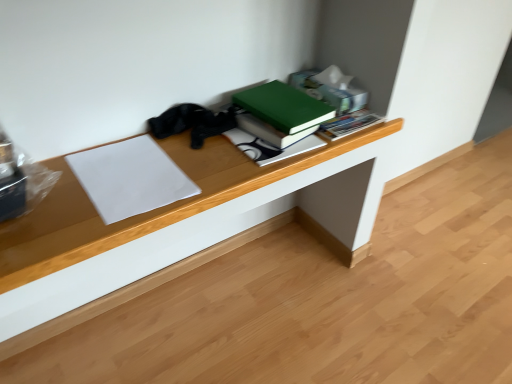
Find the location of a particular element. Image resolution: width=512 pixels, height=384 pixels. wooden desk at center is located at coordinates (150, 211).

The image size is (512, 384). Identify the location of green matte book at upper center, positioned as the 2th paperback book in bottom-to-top order. (283, 107).

From the image's perspective, is green matte book at upper center, which is counted as the 2th paperback book, starting from the front, over wooden desk at center?

Yes, from the image's perspective, green matte book at upper center, which is counted as the 2th paperback book, starting from the front, is on top of wooden desk at center.

Are green matte book at upper center, placed as the first paperback book when sorted from top to bottom, and wooden desk at center far apart?

green matte book at upper center, placed as the first paperback book when sorted from top to bottom, is near wooden desk at center, not far away.

Is green matte book at upper center, acting as the first paperback book starting from the right, oriented away from wooden desk at center?

green matte book at upper center, acting as the first paperback book starting from the right, does not have its back to wooden desk at center.

Which of these two, green matte book at upper center, which is counted as the 2th paperback book, starting from the front, or wooden desk at center, is smaller?

Smaller between the two is wooden desk at center.

Considering the relative sizes of wooden desk at center and green matte book at upper center, positioned as the 2th paperback book in bottom-to-top order, in the image provided, is wooden desk at center shorter than green matte book at upper center, positioned as the 2th paperback book in bottom-to-top order,?

Yes.

You are a GUI agent. You are given a task and a screenshot of the screen. Output one action in this format:
    pyautogui.click(x=<x>, y=<y>)
    Task: Click on the 2nd paperback book positioned above the wooden desk at center (from the image's perspective)
    
    Given the screenshot: What is the action you would take?
    pyautogui.click(x=283, y=107)

Can you see wooden desk at center touching green matte book at upper center, placed as the first paperback book when sorted from top to bottom?

wooden desk at center and green matte book at upper center, placed as the first paperback book when sorted from top to bottom, are not in contact.

Could you tell me if wooden desk at center is turned towards green matte book at upper center, positioned as the second paperback book in left-to-right order?

No, wooden desk at center is not oriented towards green matte book at upper center, positioned as the second paperback book in left-to-right order.

Between green matte book at upper center, positioned as the 2th paperback book in bottom-to-top order, and white paper at left, placed as the 2th paperback book when sorted from top to bottom, which one has more height?

green matte book at upper center, positioned as the 2th paperback book in bottom-to-top order.

From the image's perspective, between green matte book at upper center, placed as the first paperback book when sorted from top to bottom, and white paper at left, placed as the 2th paperback book when sorted from top to bottom, who is located below?

white paper at left, placed as the 2th paperback book when sorted from top to bottom.

Would you consider green matte book at upper center, which is the 1th paperback book from back to front, to be distant from white paper at left, arranged as the first paperback book when viewed from the front?

Actually, green matte book at upper center, which is the 1th paperback book from back to front, and white paper at left, arranged as the first paperback book when viewed from the front, are a little close together.

Is point (125, 192) less distant than point (55, 205)?

No, it is behind (55, 205).

Could you tell me if white paper at left, the first paperback book positioned from the left, is turned towards wooden desk at center?

No, white paper at left, the first paperback book positioned from the left, is not turned towards wooden desk at center.

Looking at this image, from the image's perspective, does white paper at left, which is counted as the 2th paperback book, starting from the back, appear lower than wooden desk at center?

No.

Which of these two, white paper at left, which is counted as the 2th paperback book, starting from the back, or wooden desk at center, is thinner?

wooden desk at center.

What's the angular difference between wooden desk at center and white paper at left, which appears as the second paperback book when viewed from the right,'s facing directions?

2.03 degrees separate the facing orientations of wooden desk at center and white paper at left, which appears as the second paperback book when viewed from the right.

From the image's perspective, is wooden desk at center on top of white paper at left, placed as the first paperback book when sorted from bottom to top?

No, from the image's perspective, wooden desk at center is not on top of white paper at left, placed as the first paperback book when sorted from bottom to top.

From the wooden desk at center, count 2nd paperback books forward and point to it. Please provide its 2D coordinates.

[(130, 178)]

Does point (154, 182) come farther from viewer compared to point (302, 92)?

No, (154, 182) is in front of (302, 92).

How different are the orientations of white paper at left, which is counted as the 2th paperback book, starting from the back, and green matte book at upper center, placed as the first paperback book when sorted from top to bottom, in degrees?

5.6 degrees separate the facing orientations of white paper at left, which is counted as the 2th paperback book, starting from the back, and green matte book at upper center, placed as the first paperback book when sorted from top to bottom.

From a real-world perspective, between white paper at left, the first paperback book positioned from the left, and green matte book at upper center, positioned as the 2th paperback book in bottom-to-top order, who is vertically lower?

white paper at left, the first paperback book positioned from the left, from a real-world perspective.

You are a GUI agent. You are given a task and a screenshot of the screen. Output one action in this format:
    pyautogui.click(x=<x>, y=<y>)
    Task: Click on the desk behind the green matte book at upper center, positioned as the 2th paperback book in bottom-to-top order
    
    Given the screenshot: What is the action you would take?
    pyautogui.click(x=150, y=211)

Find the location of a particular element. The image size is (512, 384). desk located on the right of green matte book at upper center, which is the 1th paperback book from back to front is located at coordinates (150, 211).

When comparing their distances from white paper at left, which is counted as the 2th paperback book, starting from the back, does wooden desk at center or green matte book at upper center, placed as the first paperback book when sorted from top to bottom, seem closer?

wooden desk at center is closer to white paper at left, which is counted as the 2th paperback book, starting from the back.

Which object lies further to the anchor point green matte book at upper center, which is the 1th paperback book from back to front, white paper at left, which appears as the second paperback book when viewed from the right, or wooden desk at center?

white paper at left, which appears as the second paperback book when viewed from the right, lies further to green matte book at upper center, which is the 1th paperback book from back to front, than the other object.

When comparing their distances from wooden desk at center, does white paper at left, which is counted as the 2th paperback book, starting from the back, or green matte book at upper center, placed as the first paperback book when sorted from top to bottom, seem closer?

white paper at left, which is counted as the 2th paperback book, starting from the back, lies closer to wooden desk at center than the other object.

Considering their positions, is green matte book at upper center, positioned as the 2th paperback book in bottom-to-top order, positioned further to wooden desk at center than white paper at left, which appears as the second paperback book when viewed from the right?

green matte book at upper center, positioned as the 2th paperback book in bottom-to-top order.

Based on their spatial positions, is wooden desk at center or white paper at left, placed as the 2th paperback book when sorted from top to bottom, further from green matte book at upper center, acting as the first paperback book starting from the right?

Based on the image, white paper at left, placed as the 2th paperback book when sorted from top to bottom, appears to be further to green matte book at upper center, acting as the first paperback book starting from the right.

Which object lies further to the anchor point white paper at left, placed as the 2th paperback book when sorted from top to bottom, green matte book at upper center, placed as the first paperback book when sorted from top to bottom, or wooden desk at center?

green matte book at upper center, placed as the first paperback book when sorted from top to bottom.

Locate an element on the screen. The image size is (512, 384). paperback book situated between white paper at left, which appears as the second paperback book when viewed from the right, and wooden desk at center from left to right is located at coordinates pos(283,107).